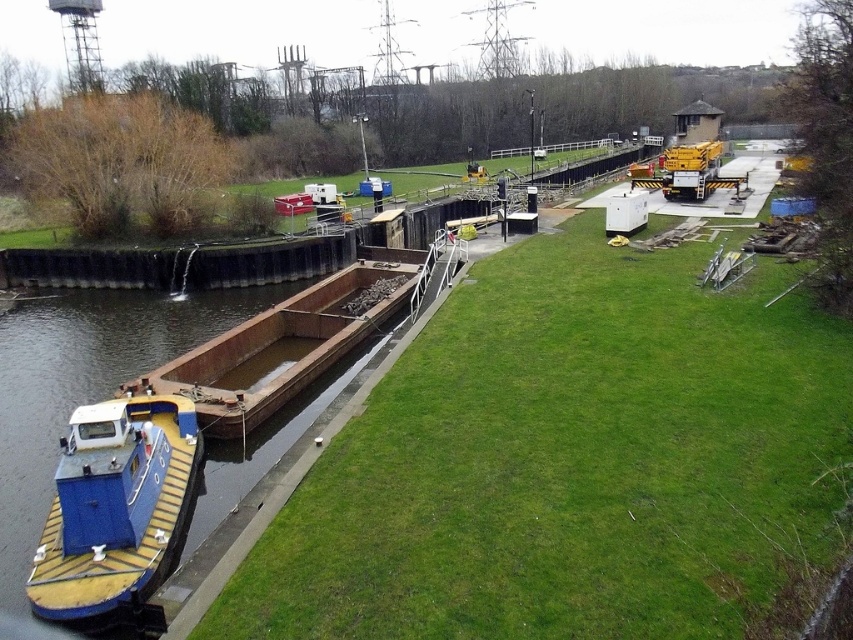
Does green grass at center lie behind blue painted wood boat at lower left?

No, it is in front of blue painted wood boat at lower left.

Looking at this image, is green grass at center in front of blue painted wood boat at lower left?

That is True.

Locate an element on the screen. green grass at center is located at coordinates (572, 461).

This screenshot has height=640, width=853. I want to click on green grass at center, so click(572, 461).